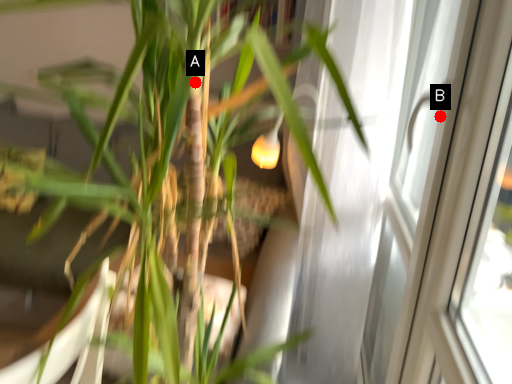
Question: Two points are circled on the image, labeled by A and B beside each circle. Which point is closer to the camera?

Choices:
 (A) A is closer
 (B) B is closer

Answer: (A)